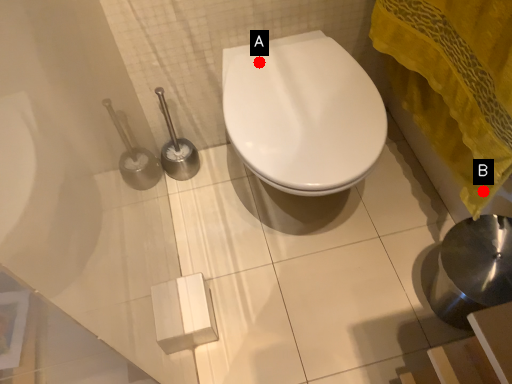
Question: Two points are circled on the image, labeled by A and B beside each circle. Among these points, which one is nearest to the camera?

Choices:
 (A) A is closer
 (B) B is closer

Answer: (B)